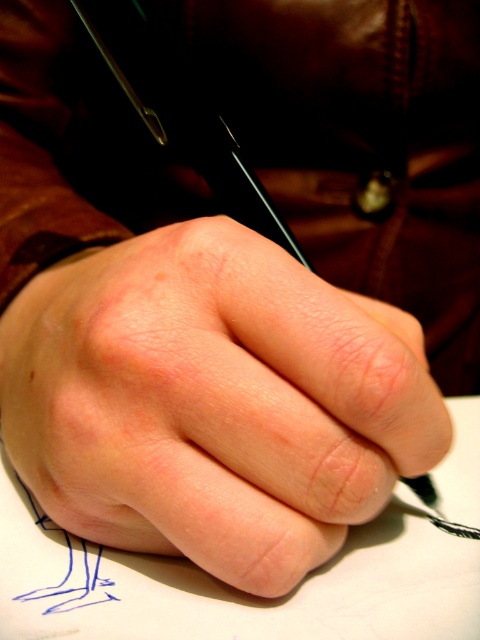
Based on the scene description, where is the smooth skin hand at center located in the image?

The smooth skin hand at center is located at point (x=213, y=401) in the image.